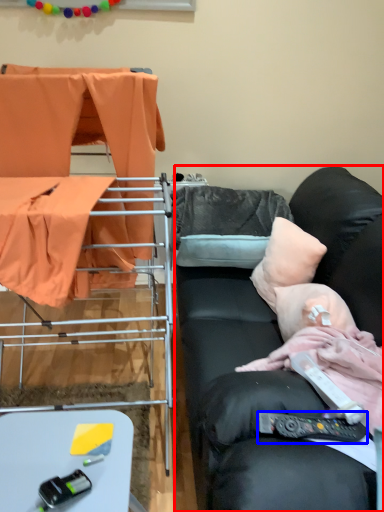
Question: Among these objects, which one is farthest to the camera, studio couch (highlighted by a red box) or remote control (highlighted by a blue box)?

Choices:
 (A) studio couch
 (B) remote control

Answer: (B)